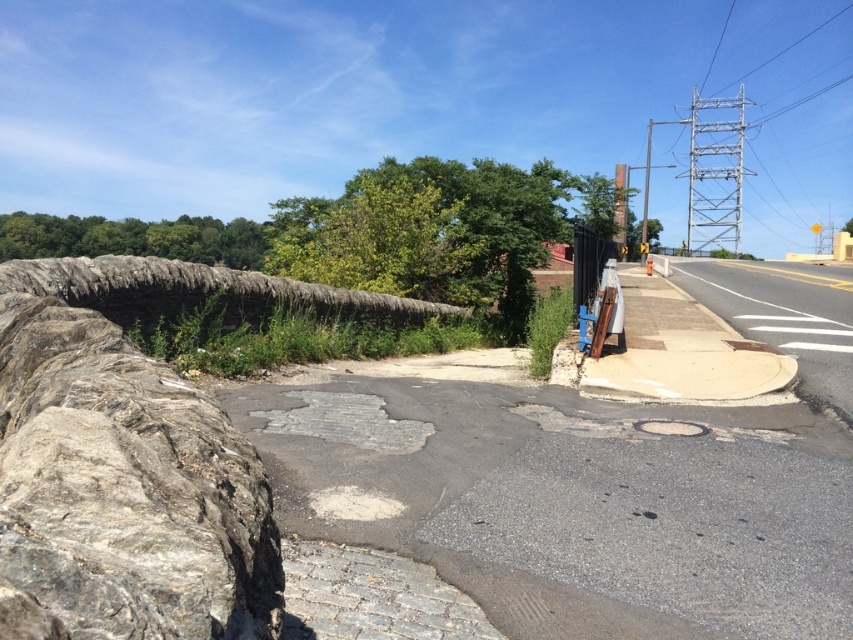
You are a painter standing on the sidewalk. You need to paint both the gray rough stone at left and the metallic gray pole at upper right. Which object should you paint first if you want to start with the taller one?

The metallic gray pole at upper right is taller than the gray rough stone at left, so you should paint the metallic gray pole at upper right first.

Consider the image. You are a painter who needs to place a 1.2 meter wide canvas between the gray rough stone at left and the metallic gray pole at upper right. Can the space between them accommodate the canvas?

The gray rough stone at left is thinner than the metallic gray pole at upper right, but the description does not provide exact measurements of the distance between them. Therefore, it is uncertain if the space can accommodate a 1.2 meter wide canvas.